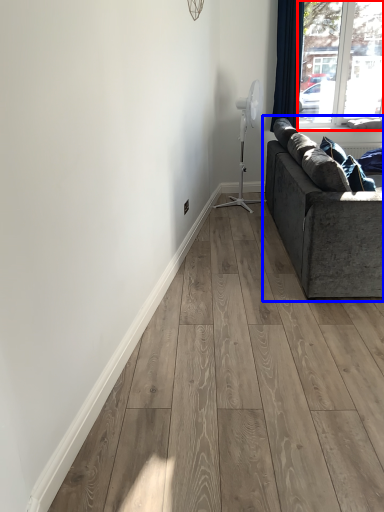
Question: Which point is further to the camera, window (highlighted by a red box) or studio couch (highlighted by a blue box)?

Choices:
 (A) window
 (B) studio couch

Answer: (A)